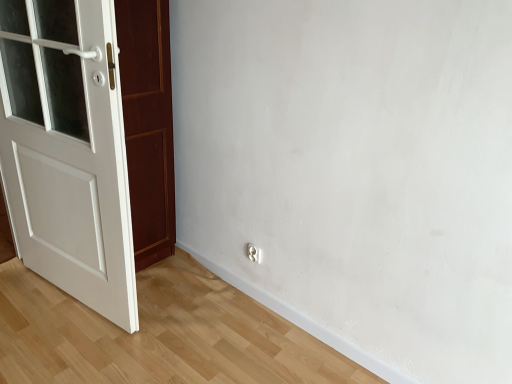
Question: From a real-world perspective, is white glossy electric outlet at lower center positioned above or below white painted wood door at left?

Choices:
 (A) above
 (B) below

Answer: (B)

Question: Is white glossy electric outlet at lower center to the left or to the right of white painted wood door at left in the image?

Choices:
 (A) left
 (B) right

Answer: (B)

Question: Does point (253, 251) appear closer or farther from the camera than point (119, 167)?

Choices:
 (A) closer
 (B) farther

Answer: (B)

Question: From a real-world perspective, relative to white glossy electric outlet at lower center, is white painted wood door at left vertically above or below?

Choices:
 (A) below
 (B) above

Answer: (B)

Question: Is white painted wood door at left bigger or smaller than white glossy electric outlet at lower center?

Choices:
 (A) small
 (B) big

Answer: (B)

Question: In the image, is white painted wood door at left on the left side or the right side of white glossy electric outlet at lower center?

Choices:
 (A) right
 (B) left

Answer: (B)

Question: Is white painted wood door at left situated inside white glossy electric outlet at lower center or outside?

Choices:
 (A) outside
 (B) inside

Answer: (A)